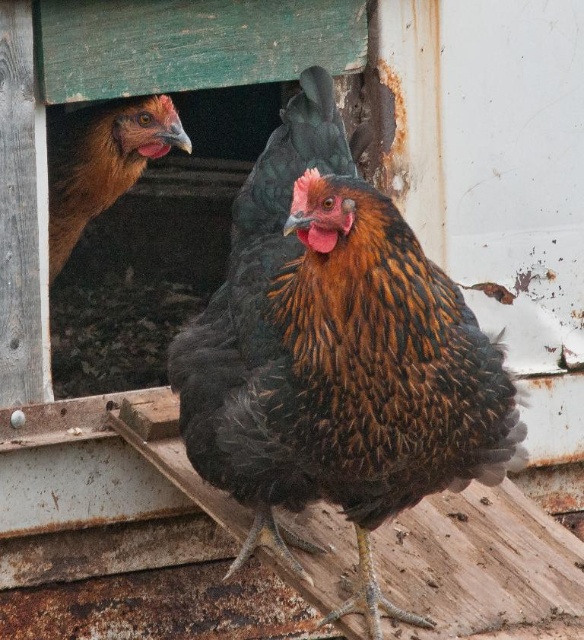
Question: Is brown speckled feathered chicken at center above brown feathered chicken at upper left?

Choices:
 (A) no
 (B) yes

Answer: (A)

Question: Which of the following is the farthest from the observer?

Choices:
 (A) (106, 152)
 (B) (519, 448)

Answer: (A)

Question: Is brown speckled feathered chicken at center smaller than brown feathered chicken at upper left?

Choices:
 (A) no
 (B) yes

Answer: (A)

Question: Which object appears farthest from the camera in this image?

Choices:
 (A) brown feathered chicken at upper left
 (B) brown speckled feathered chicken at center

Answer: (A)

Question: Can you confirm if brown speckled feathered chicken at center is wider than brown feathered chicken at upper left?

Choices:
 (A) yes
 (B) no

Answer: (A)